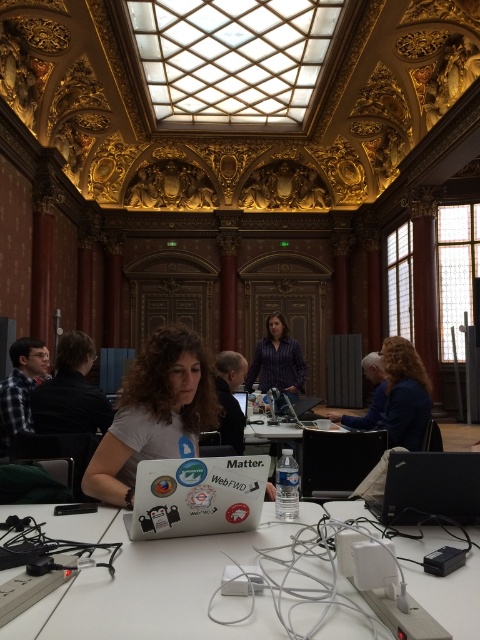
Between black matte laptop at lower right and matte purple shirt at center, which one appears on the right side from the viewer's perspective?

black matte laptop at lower right

Who is lower down, black matte laptop at lower right or matte purple shirt at center?

Positioned lower is black matte laptop at lower right.

At what (x,y) coordinates should I click in order to perform the action: click on black matte laptop at lower right. Please return your answer as a coordinate pair (x, y). Looking at the image, I should click on (429, 486).

At what (x,y) coordinates should I click in order to perform the action: click on black matte laptop at lower right. Please return your answer as a coordinate pair (x, y). Image resolution: width=480 pixels, height=640 pixels. Looking at the image, I should click on tap(429, 486).

Is point (458, 486) positioned in front of point (328, 492)?

Yes, it is.

Is black matte laptop at lower right positioned in front of black glossy laptop at center?

Yes.

Locate an element on the screen. This screenshot has width=480, height=640. black matte laptop at lower right is located at coordinates (429, 486).

This screenshot has height=640, width=480. I want to click on black matte laptop at lower right, so click(x=429, y=486).

Who is lower down, white plastic table at center or white matte laptop at center?

white plastic table at center is below.

Can you confirm if white plastic table at center is positioned to the right of white matte laptop at center?

Correct, you'll find white plastic table at center to the right of white matte laptop at center.

Find the location of a particular element. This screenshot has width=480, height=640. white plastic table at center is located at coordinates (144, 584).